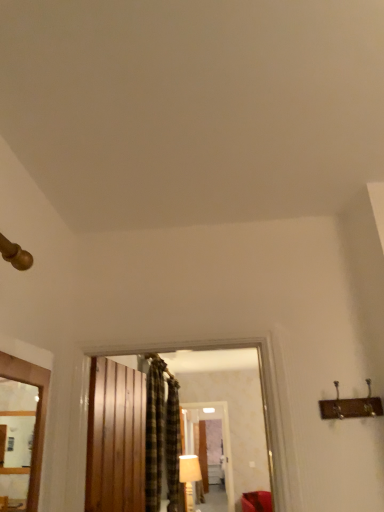
Question: Based on their positions, is plaid fabric curtain at center, placed as the second curtain when sorted from back to front, located to the left or right of matte wooden mirror at center?

Choices:
 (A) right
 (B) left

Answer: (B)

Question: From a real-world perspective, is plaid fabric curtain at center, the 1th curtain viewed from the front, positioned above or below matte wooden mirror at center?

Choices:
 (A) below
 (B) above

Answer: (B)

Question: Which of these objects is positioned closest to the matte wooden mirror at center?

Choices:
 (A) wooden frame at left
 (B) plaid fabric curtain at center, the 1th curtain viewed from the front
 (C) wooden barn door at center
 (D) plaid fabric curtain at center, arranged as the 1th curtain when viewed from the back
 (E) white fabric lampshade at center

Answer: (E)

Question: Estimate the real-world distances between objects in this image. Which object is farther from the white fabric lampshade at center?

Choices:
 (A) wooden barn door at center
 (B) wooden frame at left
 (C) plaid fabric curtain at center, placed as the second curtain when sorted from back to front
 (D) matte wooden mirror at center
 (E) plaid fabric curtain at center, arranged as the 1th curtain when viewed from the back

Answer: (B)